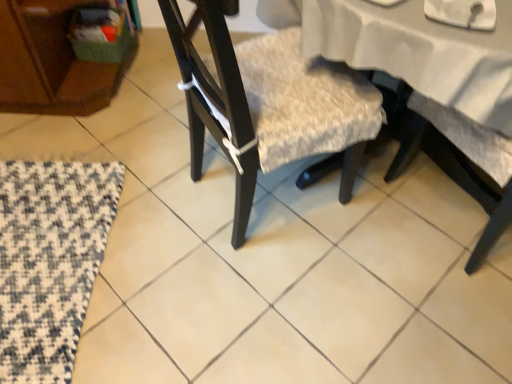
The width and height of the screenshot is (512, 384). Find the location of `textured beige cushion at center`. textured beige cushion at center is located at coordinates (268, 102).

The image size is (512, 384). Describe the element at coordinates (268, 102) in the screenshot. I see `textured beige cushion at center` at that location.

Where is `black woven mat at lower left`? The height and width of the screenshot is (384, 512). black woven mat at lower left is located at coordinates (50, 261).

Describe the element at coordinates (50, 261) in the screenshot. I see `black woven mat at lower left` at that location.

Find the location of a particular element. This screenshot has height=384, width=512. textured beige cushion at center is located at coordinates (268, 102).

Based on their positions, is black woven mat at lower left located to the left or right of textured beige cushion at center?

black woven mat at lower left is positioned on textured beige cushion at center's left side.

Which object is more forward, black woven mat at lower left or textured beige cushion at center?

Positioned in front is textured beige cushion at center.

Considering the positions of points (27, 381) and (188, 77), is point (27, 381) farther from camera compared to point (188, 77)?

No.

From the image's perspective, between black woven mat at lower left and textured beige cushion at center, which one is located above?

From the image's view, textured beige cushion at center is above.

From a real-world perspective, between black woven mat at lower left and textured beige cushion at center, who is vertically higher?

textured beige cushion at center, from a real-world perspective.

Considering the sizes of objects black woven mat at lower left and textured beige cushion at center in the image provided, who is thinner, black woven mat at lower left or textured beige cushion at center?

Thinner between the two is black woven mat at lower left.

Can you confirm if black woven mat at lower left is shorter than textured beige cushion at center?

Correct, black woven mat at lower left is not as tall as textured beige cushion at center.

Is black woven mat at lower left bigger or smaller than textured beige cushion at center?

In the image, black woven mat at lower left appears to be smaller than textured beige cushion at center.

Consider the image. Do you think black woven mat at lower left is within textured beige cushion at center, or outside of it?

black woven mat at lower left is located beyond the bounds of textured beige cushion at center.

Is black woven mat at lower left far from textured beige cushion at center?

No, black woven mat at lower left is not far from textured beige cushion at center.

Is black woven mat at lower left oriented away from textured beige cushion at center?

black woven mat at lower left is not turned away from textured beige cushion at center.

How far apart are black woven mat at lower left and textured beige cushion at center?

The distance of black woven mat at lower left from textured beige cushion at center is 24.16 inches.

This screenshot has width=512, height=384. I want to click on mat behind the textured beige cushion at center, so click(x=50, y=261).

Which object is positioned more to the left, textured beige cushion at center or black woven mat at lower left?

black woven mat at lower left.

Between textured beige cushion at center and black woven mat at lower left, which one is positioned behind?

black woven mat at lower left is further from the camera.

Between point (209, 76) and point (62, 286), which one is positioned in front?

The point (209, 76) is more forward.

From the image's perspective, which is below, textured beige cushion at center or black woven mat at lower left?

From the image's view, black woven mat at lower left is below.

From a real-world perspective, which is physically below, textured beige cushion at center or black woven mat at lower left?

black woven mat at lower left.

Considering the relative sizes of textured beige cushion at center and black woven mat at lower left in the image provided, is textured beige cushion at center wider than black woven mat at lower left?

Yes, textured beige cushion at center is wider than black woven mat at lower left.

Between textured beige cushion at center and black woven mat at lower left, which one has more height?

textured beige cushion at center.

Considering the relative sizes of textured beige cushion at center and black woven mat at lower left in the image provided, is textured beige cushion at center smaller than black woven mat at lower left?

No, textured beige cushion at center is not smaller than black woven mat at lower left.

Does textured beige cushion at center contain black woven mat at lower left?

Definitely not — black woven mat at lower left is not inside textured beige cushion at center.

Are textured beige cushion at center and black woven mat at lower left located far from each other?

No, textured beige cushion at center is in close proximity to black woven mat at lower left.

Is black woven mat at lower left at the back of textured beige cushion at center?

Yes, textured beige cushion at center is positioned with its back facing black woven mat at lower left.

Can you tell me how much textured beige cushion at center and black woven mat at lower left differ in facing direction?

They differ by 28.9 degrees in their facing directions.

How far apart are textured beige cushion at center and black woven mat at lower left?

textured beige cushion at center is 24.16 inches away from black woven mat at lower left.

The width and height of the screenshot is (512, 384). Find the location of `mat below the textured beige cushion at center (from a real-world perspective)`. mat below the textured beige cushion at center (from a real-world perspective) is located at coordinates (50, 261).

At what (x,y) coordinates should I click in order to perform the action: click on chair on the right side of black woven mat at lower left. Please return your answer as a coordinate pair (x, y). Looking at the image, I should click on (268, 102).

Where is `mat below the textured beige cushion at center (from the image's perspective)`? The image size is (512, 384). mat below the textured beige cushion at center (from the image's perspective) is located at coordinates (50, 261).